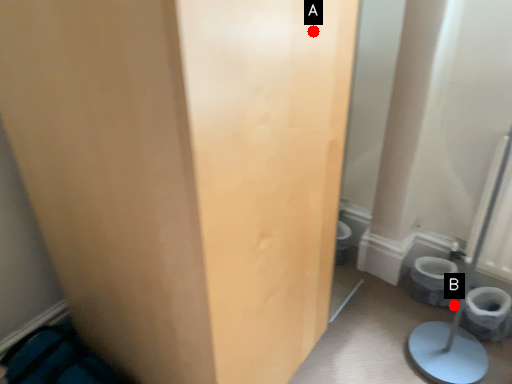
Question: Two points are circled on the image, labeled by A and B beside each circle. Which point is closer to the camera?

Choices:
 (A) A is closer
 (B) B is closer

Answer: (A)